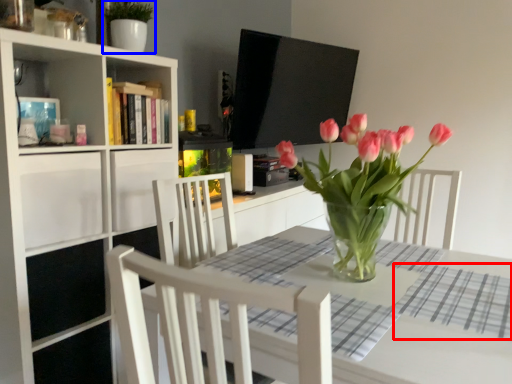
Question: Which of the following is the closest to the observer, plaid (highlighted by a red box) or plant (highlighted by a blue box)?

Choices:
 (A) plaid
 (B) plant

Answer: (A)